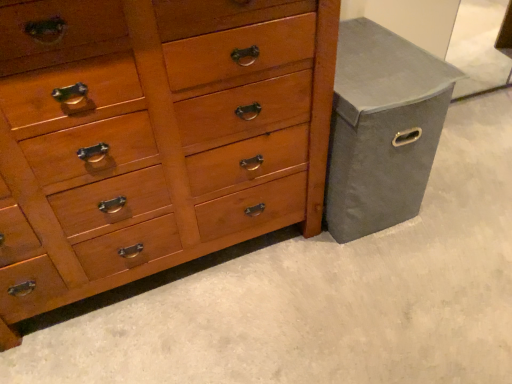
Identify the location of free spot to the right of matte gray fabric bin at right. (465, 183).